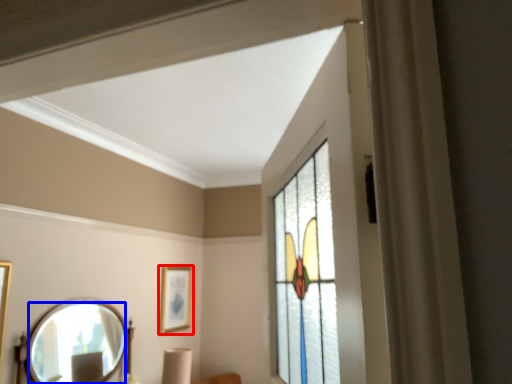
Question: Among these objects, which one is farthest to the camera, picture frame (highlighted by a red box) or mirror (highlighted by a blue box)?

Choices:
 (A) picture frame
 (B) mirror

Answer: (A)